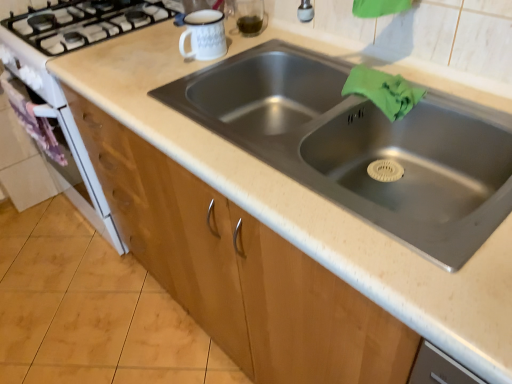
Question: Does point (354, 84) appear closer or farther from the camera than point (302, 173)?

Choices:
 (A) farther
 (B) closer

Answer: (A)

Question: Based on their positions, is green fabric at sink right located to the left or right of stainless steel sink at center?

Choices:
 (A) right
 (B) left

Answer: (A)

Question: Which is nearer to the green fabric at sink right?

Choices:
 (A) wooden cabinet at lower center
 (B) stainless steel sink at center

Answer: (B)

Question: Estimate the real-world distances between objects in this image. Which object is closer to the stainless steel sink at center?

Choices:
 (A) wooden cabinet at lower center
 (B) green fabric at sink right

Answer: (B)